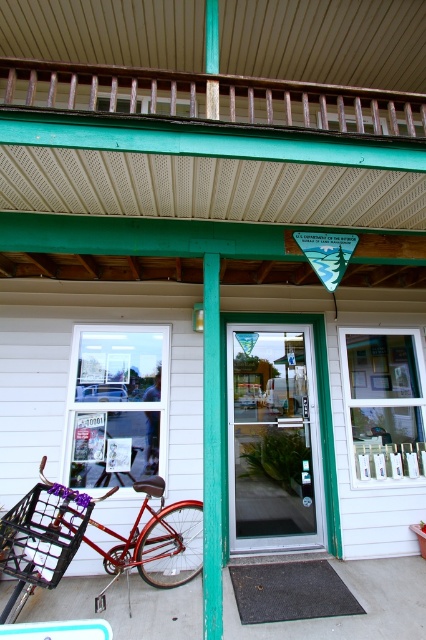
Question: Among these objects, which one is farthest from the camera?

Choices:
 (A) teal painted wood post at center
 (B) clear glass door at center

Answer: (B)

Question: Can you confirm if shiny red bicycle at lower left is bigger than teal painted wood post at center?

Choices:
 (A) no
 (B) yes

Answer: (B)

Question: Among these objects, which one is farthest from the camera?

Choices:
 (A) clear glass door at center
 (B) rusty wood rail at upper center

Answer: (A)

Question: Which object appears farthest from the camera in this image?

Choices:
 (A) shiny red bicycle at lower left
 (B) clear glass door at center

Answer: (B)

Question: Considering the relative positions of clear glass door at center and rusty wood rail at upper center in the image provided, where is clear glass door at center located with respect to rusty wood rail at upper center?

Choices:
 (A) left
 (B) right

Answer: (B)

Question: Is clear glass door at center further to the viewer compared to rusty wood rail at upper center?

Choices:
 (A) no
 (B) yes

Answer: (B)